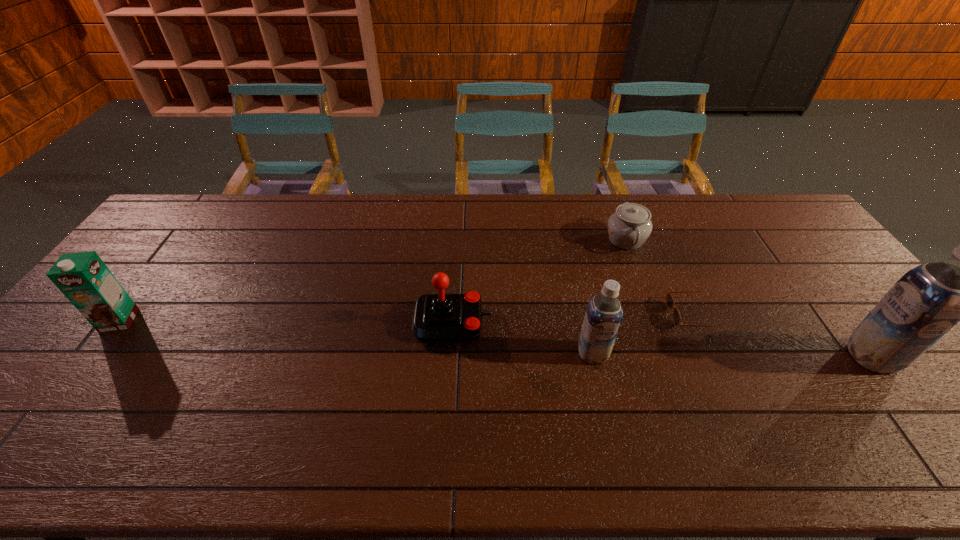
Identify the location of vacant area between the second object from left to right and the sunglasses. (572, 319).

Where is `vacant space in between the carton and the shorter soya milk`? vacant space in between the carton and the shorter soya milk is located at coordinates (356, 337).

Locate an element on the screen. Image resolution: width=960 pixels, height=540 pixels. free spot between the shortest object and the second shortest object is located at coordinates (660, 278).

The height and width of the screenshot is (540, 960). I want to click on free space between the carton and the rightmost object, so click(x=495, y=339).

You are a GUI agent. You are given a task and a screenshot of the screen. Output one action in this format:
    pyautogui.click(x=<x>, y=<y>)
    Task: Click on the unoccupied position between the leftmost object and the third shortest object
    Image resolution: width=960 pixels, height=540 pixels.
    Given the screenshot: What is the action you would take?
    coord(286,321)

What are the coordinates of `free spot between the farthest object and the shortest object` in the screenshot? It's located at (660, 278).

Where is `object that can be found as the third closest to the left soya milk`? object that can be found as the third closest to the left soya milk is located at coordinates click(629, 227).

What are the coordinates of `object that is the nearest to the sunglasses` in the screenshot? It's located at (629, 227).

Where is `free space in the image that satisfies the following two spatial constraints: 1. on the front-facing side of the sunglasses; 2. on the label of the fourth object from right to left`? The width and height of the screenshot is (960, 540). free space in the image that satisfies the following two spatial constraints: 1. on the front-facing side of the sunglasses; 2. on the label of the fourth object from right to left is located at coordinates [710, 353].